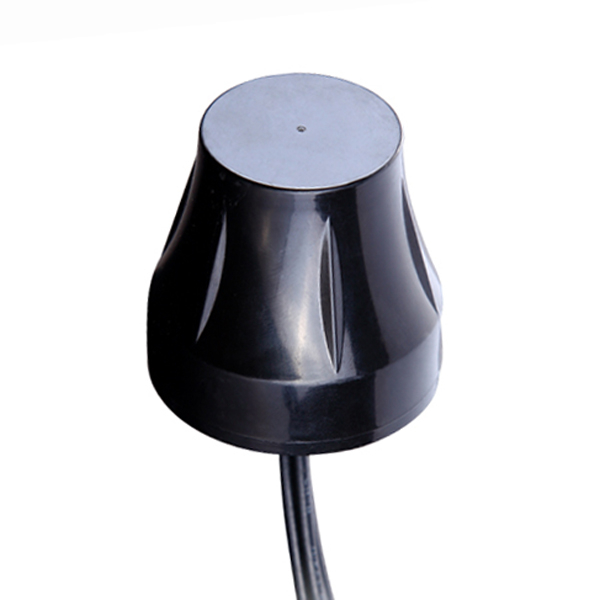
Image resolution: width=600 pixels, height=600 pixels. In order to click on lamp in this screenshot , I will do `click(328, 311)`.